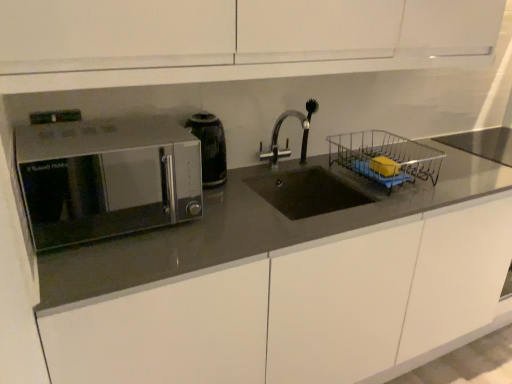
Question: From the image's perspective, is silver metallic faucet at center below satin metallic microwave at left?

Choices:
 (A) yes
 (B) no

Answer: (B)

Question: From a real-world perspective, is silver metallic faucet at center physically above satin metallic microwave at left?

Choices:
 (A) no
 (B) yes

Answer: (B)

Question: Does silver metallic faucet at center have a greater width compared to satin metallic microwave at left?

Choices:
 (A) no
 (B) yes

Answer: (A)

Question: Is silver metallic faucet at center completely or partially outside of satin metallic microwave at left?

Choices:
 (A) no
 (B) yes

Answer: (B)

Question: Considering the relative positions of silver metallic faucet at center and satin metallic microwave at left in the image provided, is silver metallic faucet at center to the left of satin metallic microwave at left from the viewer's perspective?

Choices:
 (A) no
 (B) yes

Answer: (B)

Question: Would you say metallic wire basket at center right is inside or outside satin silver microwave at left?

Choices:
 (A) outside
 (B) inside

Answer: (A)

Question: In terms of size, does metallic wire basket at center right appear bigger or smaller than satin silver microwave at left?

Choices:
 (A) small
 (B) big

Answer: (A)

Question: Does point (393, 140) appear closer or farther from the camera than point (144, 168)?

Choices:
 (A) farther
 (B) closer

Answer: (B)

Question: From the image's perspective, is metallic wire basket at center right positioned above or below satin silver microwave at left?

Choices:
 (A) below
 (B) above

Answer: (B)

Question: From a real-world perspective, is satin silver microwave at left above or below satin metallic microwave at left?

Choices:
 (A) above
 (B) below

Answer: (A)

Question: In the image, is satin silver microwave at left on the left side or the right side of satin metallic microwave at left?

Choices:
 (A) left
 (B) right

Answer: (A)

Question: Is satin silver microwave at left bigger or smaller than satin metallic microwave at left?

Choices:
 (A) small
 (B) big

Answer: (A)

Question: From the image's perspective, is satin silver microwave at left positioned above or below satin metallic microwave at left?

Choices:
 (A) above
 (B) below

Answer: (A)

Question: Is silver metallic faucet at center situated inside metallic wire basket at center right or outside?

Choices:
 (A) inside
 (B) outside

Answer: (B)

Question: Looking at their shapes, would you say silver metallic faucet at center is wider or thinner than metallic wire basket at center right?

Choices:
 (A) wide
 (B) thin

Answer: (B)